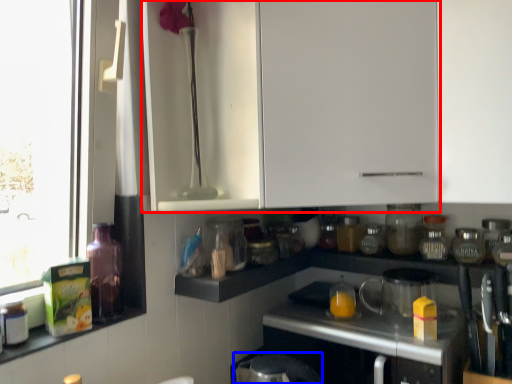
Question: Which object appears closest to the camera in this image, cabinetry (highlighted by a red box) or appliance (highlighted by a blue box)?

Choices:
 (A) cabinetry
 (B) appliance

Answer: (B)